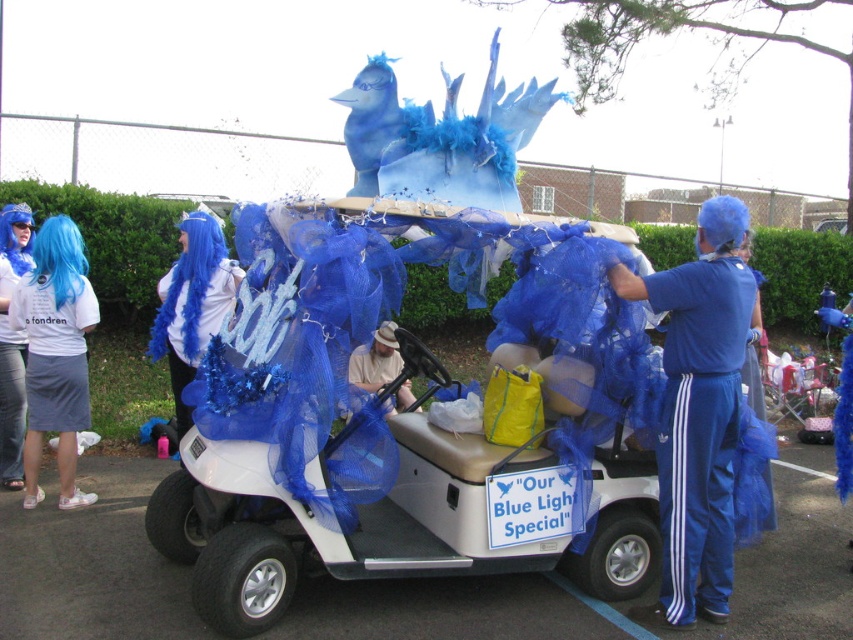
From the picture: Which is above, white fabric wig at upper left or blue silky wig at upper left?

blue silky wig at upper left is higher up.

Which of these two, white fabric wig at upper left or blue silky wig at upper left, stands taller?

With more height is white fabric wig at upper left.

Based on the photo, who is more distant from viewer, (86, 493) or (0, 216)?

Positioned behind is point (0, 216).

The height and width of the screenshot is (640, 853). I want to click on white fabric wig at upper left, so click(55, 353).

Is point (729, 196) positioned behind point (9, 241)?

No, it is not.

Does blue tulle wig at center appear on the right side of blue silky wig at upper left?

Correct, you'll find blue tulle wig at center to the right of blue silky wig at upper left.

Is point (741, 227) positioned behind point (22, 209)?

No, it is in front of (22, 209).

What are the coordinates of `blue tulle wig at center` in the screenshot? It's located at (721, 225).

How distant is blue fabric wig at left from beige fabric hat at center?

blue fabric wig at left is 2.45 meters from beige fabric hat at center.

Who is taller, blue fabric wig at left or beige fabric hat at center?

Standing taller between the two is blue fabric wig at left.

Is point (19, 472) less distant than point (390, 374)?

Yes, point (19, 472) is in front of point (390, 374).

This screenshot has width=853, height=640. Identify the location of blue fabric wig at left. (12, 340).